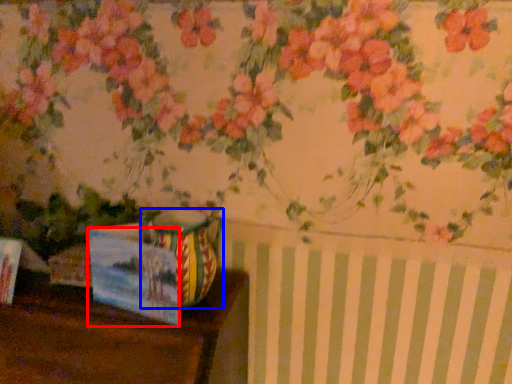
Question: Which of the following is the closest to the observer, postcard (highlighted by a red box) or vase (highlighted by a blue box)?

Choices:
 (A) postcard
 (B) vase

Answer: (A)